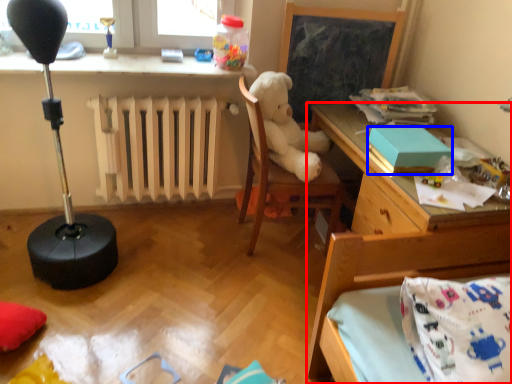
Question: Which point is closer to the camera, desk (highlighted by a red box) or box (highlighted by a blue box)?

Choices:
 (A) desk
 (B) box

Answer: (A)